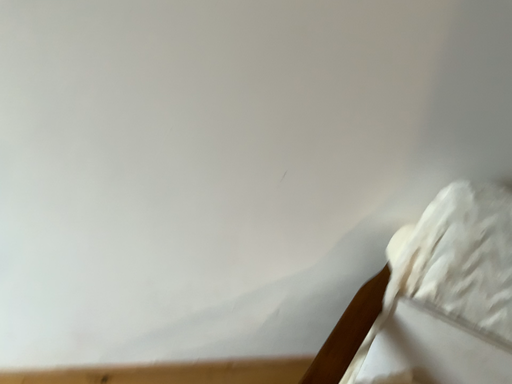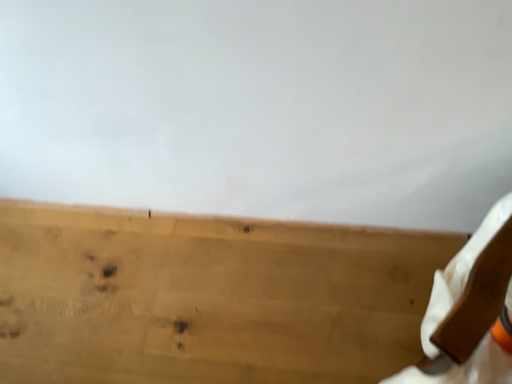
Question: How did the camera likely rotate when shooting the video?

Choices:
 (A) rotated left
 (B) rotated right

Answer: (A)